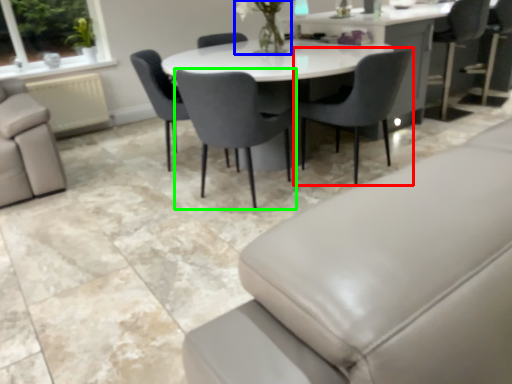
Question: Estimate the real-world distances between objects in this image. Which object is farther from chair (highlighted by a red box), floral arrangement (highlighted by a blue box) or chair (highlighted by a green box)?

Choices:
 (A) floral arrangement
 (B) chair

Answer: (A)